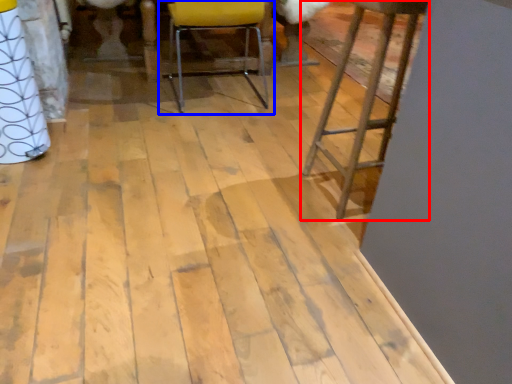
Question: Among these objects, which one is nearest to the camera, furniture (highlighted by a red box) or chair (highlighted by a blue box)?

Choices:
 (A) furniture
 (B) chair

Answer: (A)